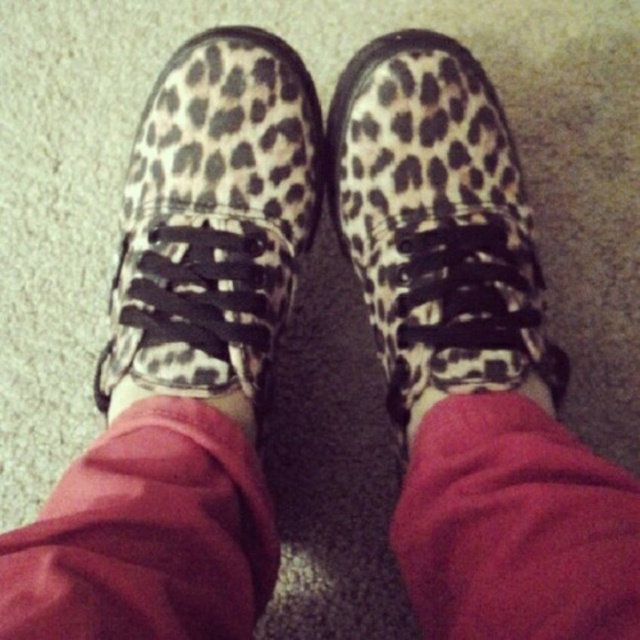
Can you confirm if leopard print sneaker at center is taller than pink fabric sock at center?

Correct, leopard print sneaker at center is much taller as pink fabric sock at center.

Can you confirm if leopard print sneaker at center is shorter than pink fabric sock at center?

In fact, leopard print sneaker at center may be taller than pink fabric sock at center.

Where is `leopard print sneaker at center`? This screenshot has width=640, height=640. leopard print sneaker at center is located at coordinates [x=212, y=220].

Describe the element at coordinates (436, 224) in the screenshot. The height and width of the screenshot is (640, 640). I see `leopard print shoe at center` at that location.

Is leopard print shoe at center closer to the viewer compared to pink fabric sock at center?

No, it is behind pink fabric sock at center.

Locate an element on the screen. The image size is (640, 640). leopard print shoe at center is located at coordinates (436, 224).

Does leopard print sneaker at center appear on the left side of leopard print shoe at center?

Indeed, leopard print sneaker at center is positioned on the left side of leopard print shoe at center.

Image resolution: width=640 pixels, height=640 pixels. I want to click on leopard print sneaker at center, so click(212, 220).